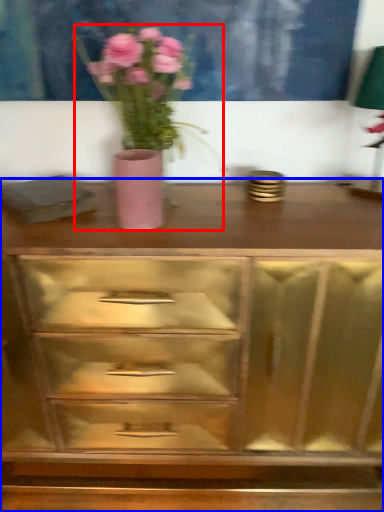
Question: Which point is further to the camera, floral arrangement (highlighted by a red box) or chest of drawers (highlighted by a blue box)?

Choices:
 (A) floral arrangement
 (B) chest of drawers

Answer: (B)